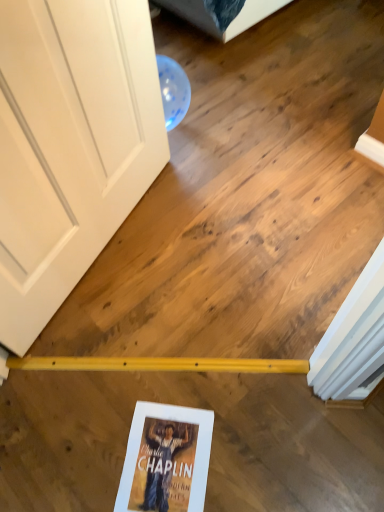
Question: From the image's perspective, would you say white matte door at upper left is shown under hardcover book at lower center?

Choices:
 (A) yes
 (B) no

Answer: (B)

Question: Can you confirm if white matte door at upper left is taller than hardcover book at lower center?

Choices:
 (A) yes
 (B) no

Answer: (A)

Question: Is white matte door at upper left further to camera compared to hardcover book at lower center?

Choices:
 (A) no
 (B) yes

Answer: (A)

Question: Can you confirm if white matte door at upper left is positioned to the left of hardcover book at lower center?

Choices:
 (A) no
 (B) yes

Answer: (B)

Question: Is white matte door at upper left facing away from hardcover book at lower center?

Choices:
 (A) yes
 (B) no

Answer: (B)

Question: Does white matte door at upper left have a larger size compared to hardcover book at lower center?

Choices:
 (A) no
 (B) yes

Answer: (B)

Question: Would you consider hardcover book at lower center to be distant from white matte door at upper left?

Choices:
 (A) yes
 (B) no

Answer: (B)

Question: From the image's perspective, would you say hardcover book at lower center is positioned over white matte door at upper left?

Choices:
 (A) no
 (B) yes

Answer: (A)

Question: Would you say hardcover book at lower center is outside white matte door at upper left?

Choices:
 (A) yes
 (B) no

Answer: (A)

Question: Is hardcover book at lower center thinner than white matte door at upper left?

Choices:
 (A) no
 (B) yes

Answer: (A)

Question: Is hardcover book at lower center smaller than white matte door at upper left?

Choices:
 (A) yes
 (B) no

Answer: (A)

Question: Is hardcover book at lower center in contact with white matte door at upper left?

Choices:
 (A) yes
 (B) no

Answer: (B)

Question: From the image's perspective, is white matte door at upper left positioned above or below hardcover book at lower center?

Choices:
 (A) above
 (B) below

Answer: (A)